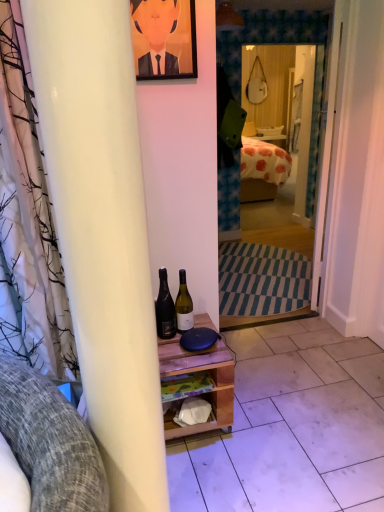
The image size is (384, 512). I want to click on blank space situated above white tile at lower right, which is the first tile from right to left (from a real-world perspective), so click(364, 360).